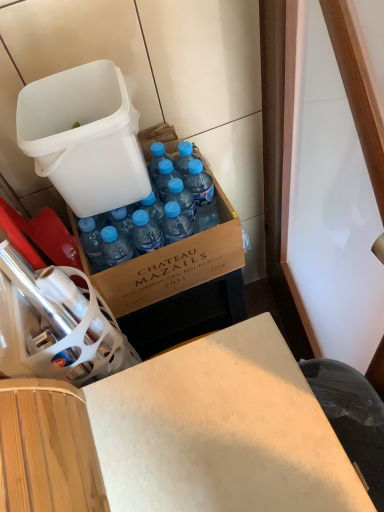
Where is `vacant area on top of wooden desk at center (from a real-world perspective)`? The width and height of the screenshot is (384, 512). vacant area on top of wooden desk at center (from a real-world perspective) is located at coordinates (185, 431).